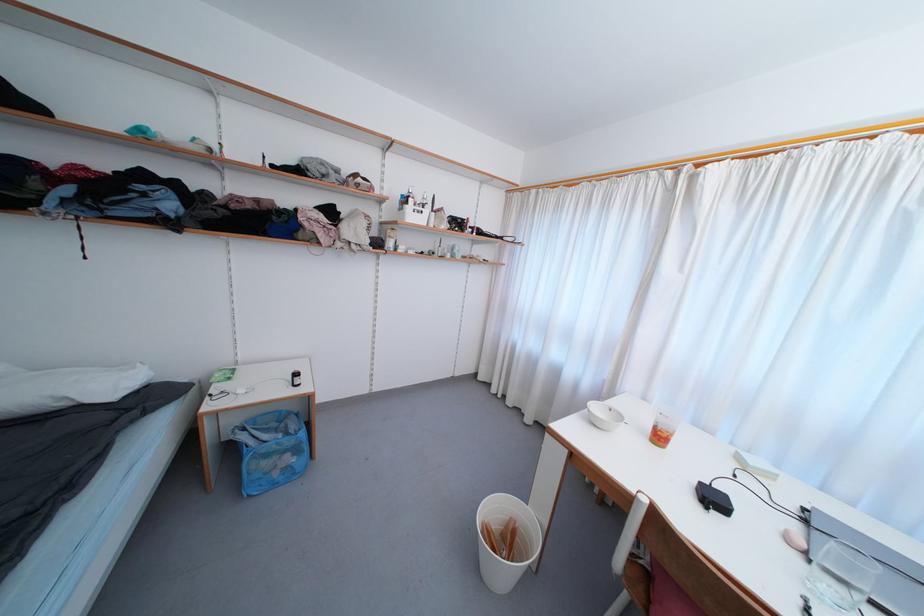
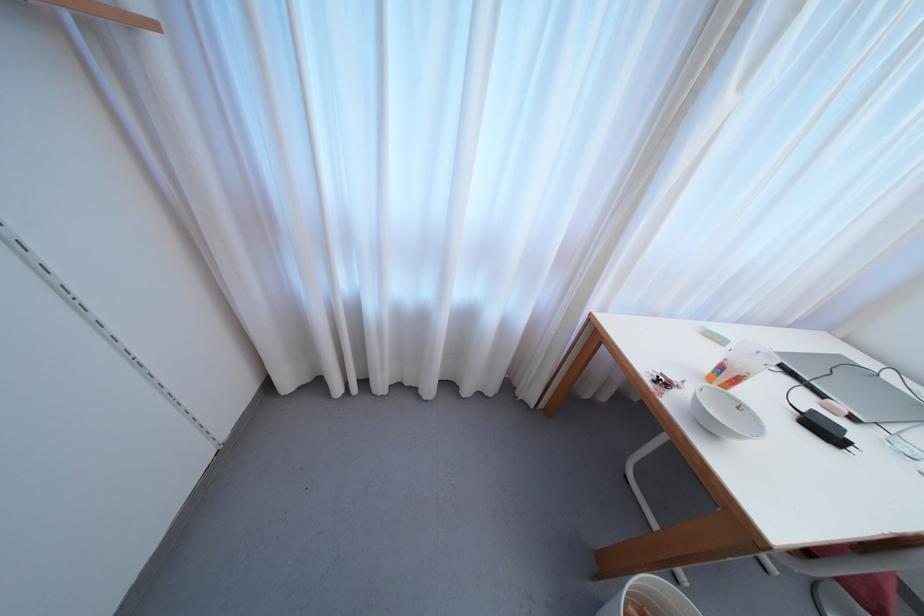
Locate, in the second image, the point that corresponds to the point at 730,499 in the first image.

(817, 415)